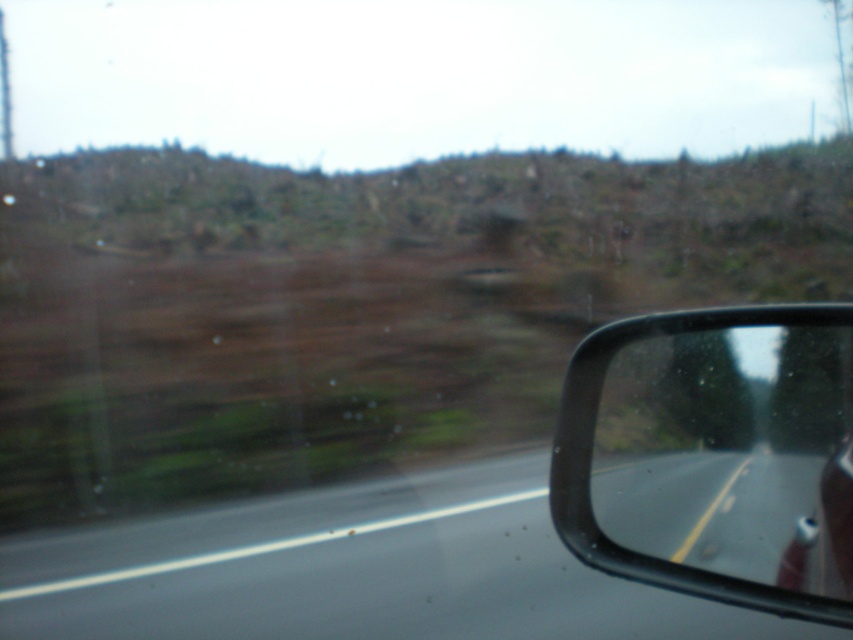
Question: Does smooth asphalt road at center appear on the left side of black plastic mirror at right?

Choices:
 (A) no
 (B) yes

Answer: (B)

Question: Which object appears farthest from the camera in this image?

Choices:
 (A) black plastic mirror at right
 (B) smooth asphalt road at center

Answer: (B)

Question: Can you confirm if smooth asphalt road at center is wider than black plastic mirror at right?

Choices:
 (A) yes
 (B) no

Answer: (B)

Question: Does smooth asphalt road at center lie behind black plastic mirror at right?

Choices:
 (A) yes
 (B) no

Answer: (A)